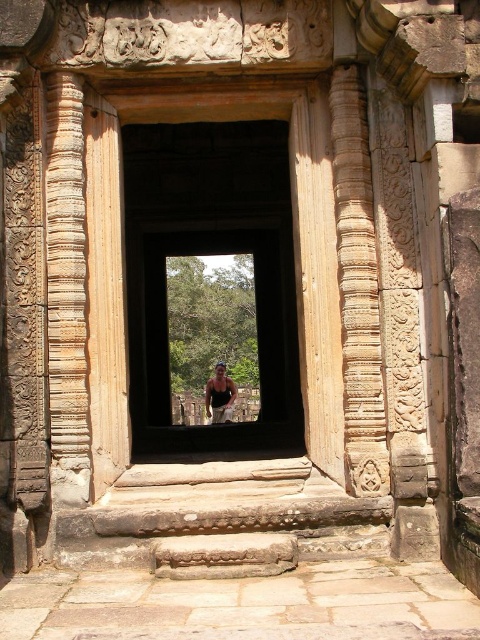
Question: Which point appears farthest from the camera in this image?

Choices:
 (A) (297, 163)
 (B) (220, 397)

Answer: (B)

Question: Can you confirm if brown stone door at center is positioned to the right of matte black tank top at center?

Choices:
 (A) yes
 (B) no

Answer: (A)

Question: Does brown stone door at center appear on the right side of matte black tank top at center?

Choices:
 (A) yes
 (B) no

Answer: (A)

Question: Does brown stone door at center appear on the left side of matte black tank top at center?

Choices:
 (A) no
 (B) yes

Answer: (A)

Question: Among these objects, which one is nearest to the camera?

Choices:
 (A) brown stone door at center
 (B) matte black tank top at center

Answer: (A)